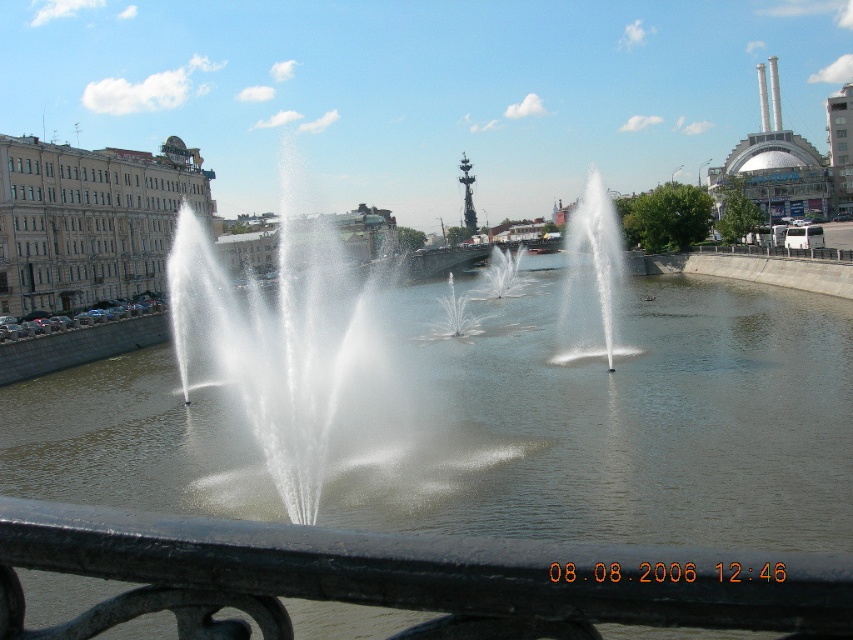
Question: Based on their relative distances, which object is farther from the white water at center?

Choices:
 (A) brown concrete river at center
 (B) white frothy water at center
 (C) black metal rail at lower center

Answer: (C)

Question: Observing the image, what is the correct spatial positioning of black metal rail at lower center in reference to white frothy water at center?

Choices:
 (A) below
 (B) above

Answer: (A)

Question: Is brown concrete river at center thinner than white frothy water at center?

Choices:
 (A) yes
 (B) no

Answer: (B)

Question: Does black metal rail at lower center appear on the left side of white water at center?

Choices:
 (A) no
 (B) yes

Answer: (B)

Question: Among these objects, which one is farthest from the camera?

Choices:
 (A) brown concrete river at center
 (B) black metal rail at lower center
 (C) white water at center
 (D) white frothy water at center

Answer: (D)

Question: Which object is the farthest from the black metal rail at lower center?

Choices:
 (A) white water at center
 (B) brown concrete river at center
 (C) white frothy water at center

Answer: (C)